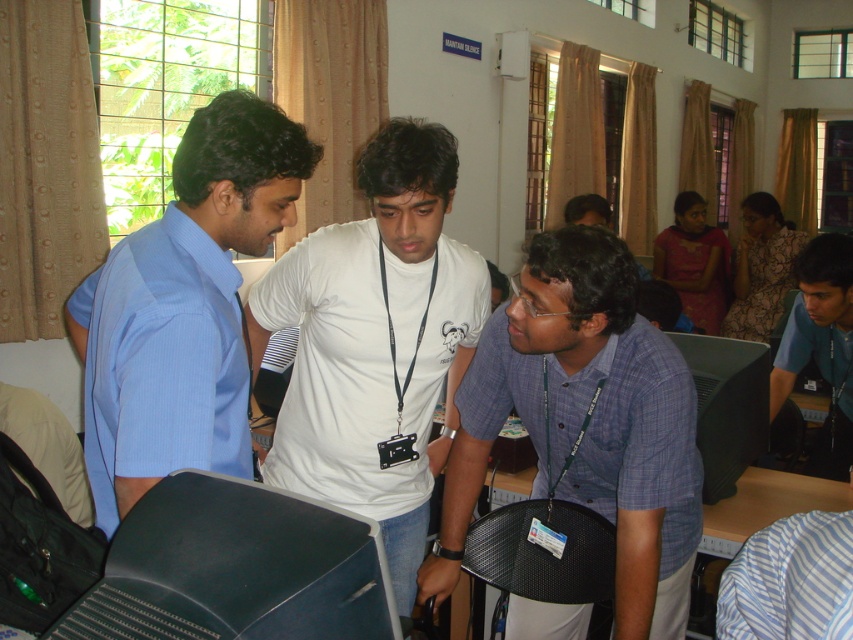
You are a photographer standing behind the blue plaid shirt at center and the light blue shirt at left. Which person should you focus on to capture their full height in the photo?

The blue plaid shirt at center is taller than the light blue shirt at left, so focusing on the blue plaid shirt at center will ensure their full height is captured in the photo.

You are a photographer standing in front of the computer workstation. You want to take a photo of both the blue plaid shirt at center and the light blue shirt at left. Which one will appear larger in the photo?

The blue plaid shirt at center will appear larger in the photo because it is closer to the photographer than the light blue shirt at left.